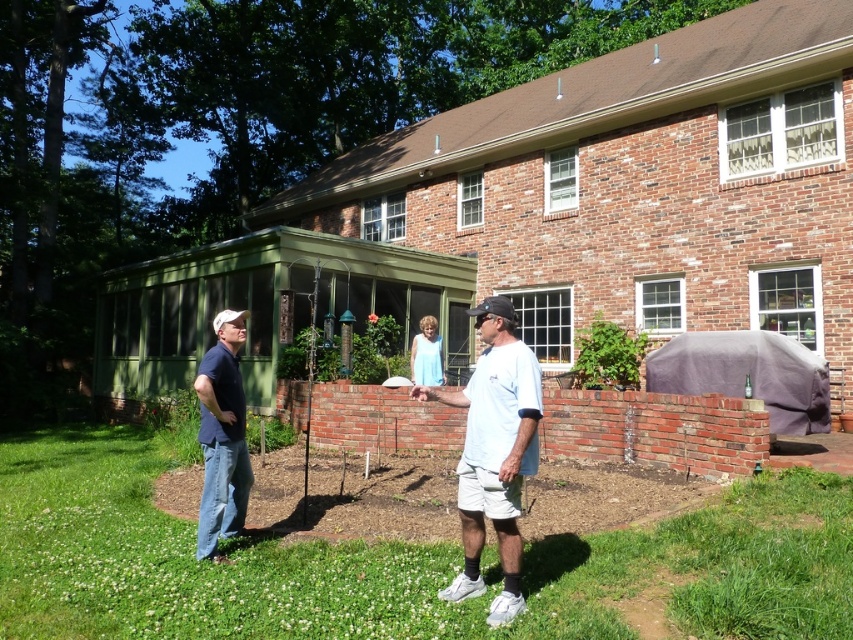
Is point (740, 616) closer to viewer compared to point (529, 467)?

Yes.

Image resolution: width=853 pixels, height=640 pixels. Find the location of `green grass at lower center`. green grass at lower center is located at coordinates (392, 563).

Is point (128, 554) in front of point (502, 467)?

No, (128, 554) is further to viewer.

This screenshot has height=640, width=853. Identify the location of green grass at lower center. [392, 563].

The image size is (853, 640). Describe the element at coordinates (492, 452) in the screenshot. I see `light blue dress at center` at that location.

Identify the location of light blue dress at center. (492, 452).

Image resolution: width=853 pixels, height=640 pixels. I want to click on light blue dress at center, so coord(492,452).

Which is below, light blue dress at center or dark blue shirt at left?

dark blue shirt at left is lower down.

Does light blue dress at center have a greater width compared to dark blue shirt at left?

Correct, the width of light blue dress at center exceeds that of dark blue shirt at left.

Identify the location of light blue dress at center. The width and height of the screenshot is (853, 640). (492, 452).